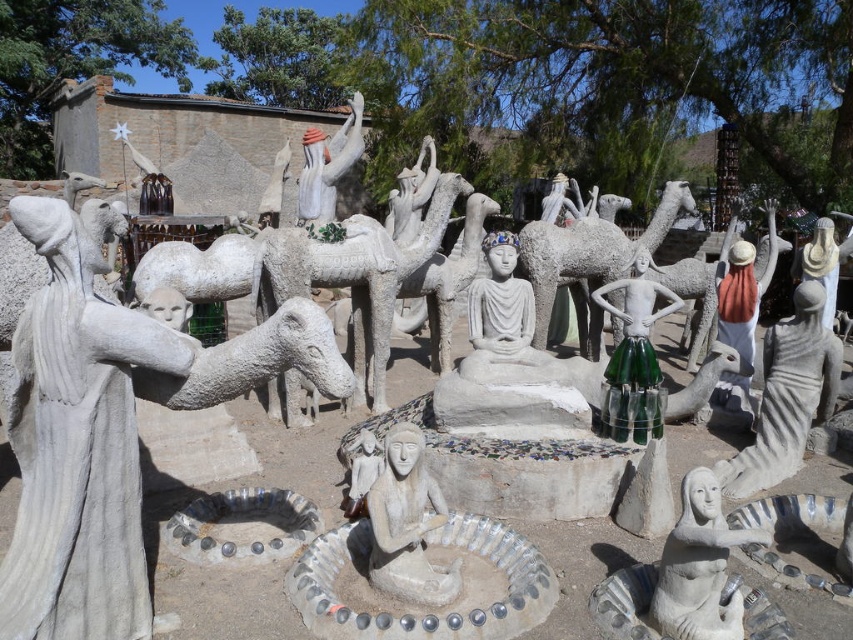
You are an art curator planning to photograph the white stone statue at lower right and the white stone statue at center. To ensure both are fully visible in the frame, which statue should you position closer to the camera?

You should position the white stone statue at lower right closer to the camera because it is already in front of the white stone statue at center, so moving it closer will help ensure both are visible without obstruction.

From the picture: You are an art curator planning to move the green glass skirt at center and the white stone statue at center to a new exhibition space. The display area has a height restriction of 2 meters. Can both objects fit vertically without being modified?

The green glass skirt at center has a larger size compared to the white stone statue at center, but the exact dimensions are not provided. Without knowing their specific heights, it is impossible to determine if they will fit under the 2 meter height restriction.

Looking at this image, you are standing in front of the stone sculptures and want to locate the point at coordinate (634, 356). According to the scene description, where exactly is this point located?

The point at coordinate (634, 356) is on the green glass skirt at center.